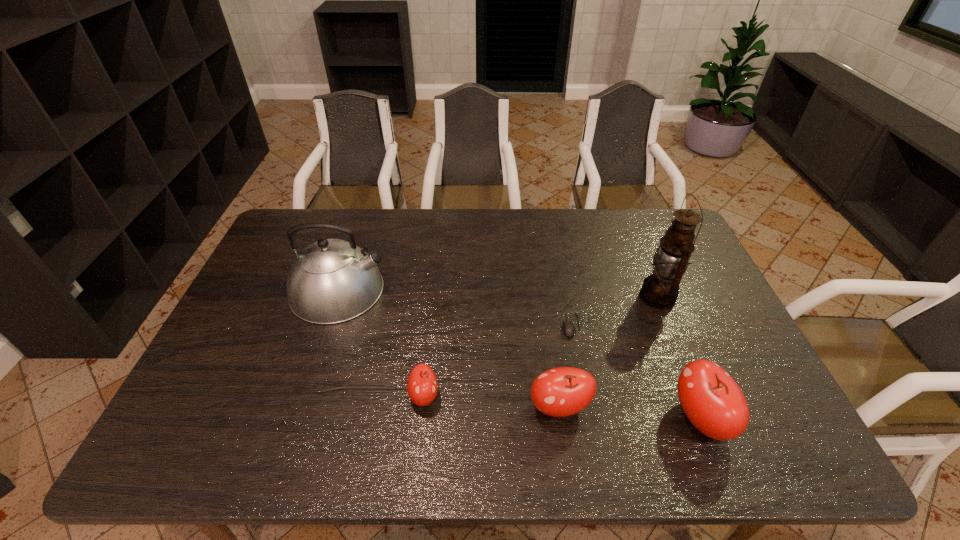
Locate an element on the screen. The image size is (960, 540). free spot between the second apple from right to left and the fifth tallest object is located at coordinates (492, 402).

Where is `free space that is in between the rightmost apple and the mouse`? This screenshot has width=960, height=540. free space that is in between the rightmost apple and the mouse is located at coordinates (636, 372).

Find the location of `free area in between the oil lamp and the mouse`. free area in between the oil lamp and the mouse is located at coordinates (614, 311).

Identify which object is the fifth nearest to the tallest object. Please provide its 2D coordinates. Your answer should be formatted as a tuple, i.e. [(x, y)], where the tuple contains the x and y coordinates of a point satisfying the conditions above.

[(331, 281)]

At what (x,y) coordinates should I click in order to perform the action: click on object that ranks as the fourth closest to the fifth tallest object. Please return your answer as a coordinate pair (x, y). The width and height of the screenshot is (960, 540). Looking at the image, I should click on 713,402.

At what (x,y) coordinates should I click in order to perform the action: click on apple identified as the third closest to the shortest object. Please return your answer as a coordinate pair (x, y). Looking at the image, I should click on (422, 386).

The image size is (960, 540). I want to click on apple that is the second closest one to the second shortest object, so click(713, 402).

In order to click on vacant space that satisfies the following two spatial constraints: 1. from the spout of the kettle; 2. on the left side of the shortest apple in this screenshot , I will do `click(303, 396)`.

Identify the location of free location that satisfies the following two spatial constraints: 1. on the back side of the tallest object; 2. on the left side of the shortest apple. (435, 297).

You are a GUI agent. You are given a task and a screenshot of the screen. Output one action in this format:
    pyautogui.click(x=<x>, y=<y>)
    Task: Click on the vacant region that satisfies the following two spatial constraints: 1. from the spout of the kettle; 2. on the left side of the shortest object
    This screenshot has height=540, width=960.
    Given the screenshot: What is the action you would take?
    pyautogui.click(x=327, y=325)